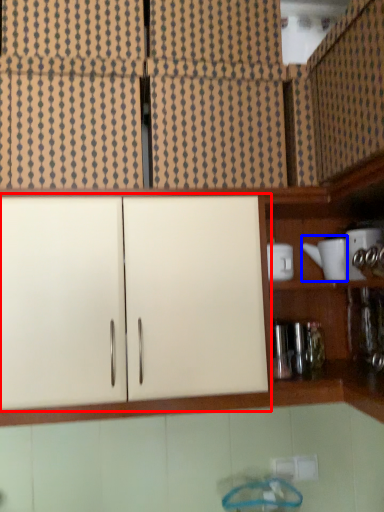
Question: Which object is further to the camera taking this photo, cabinetry (highlighted by a red box) or appliance (highlighted by a blue box)?

Choices:
 (A) cabinetry
 (B) appliance

Answer: (B)